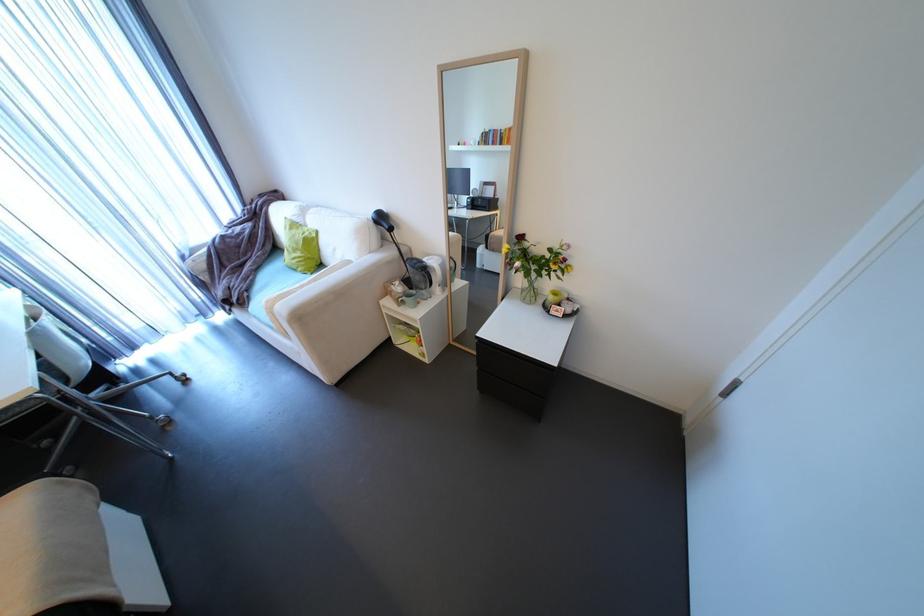
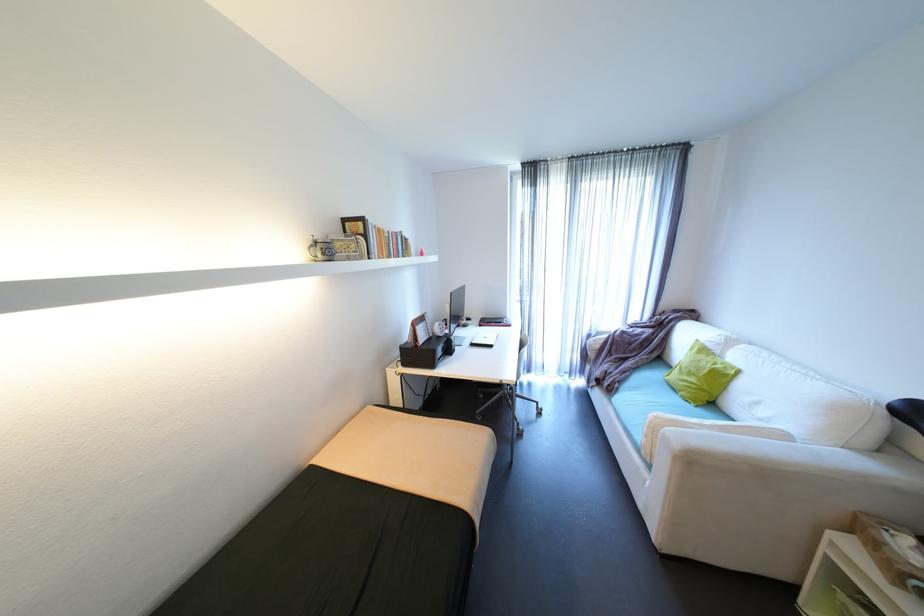
Where in the second image is the point corresponding to point 254,283 from the first image?

(630, 377)